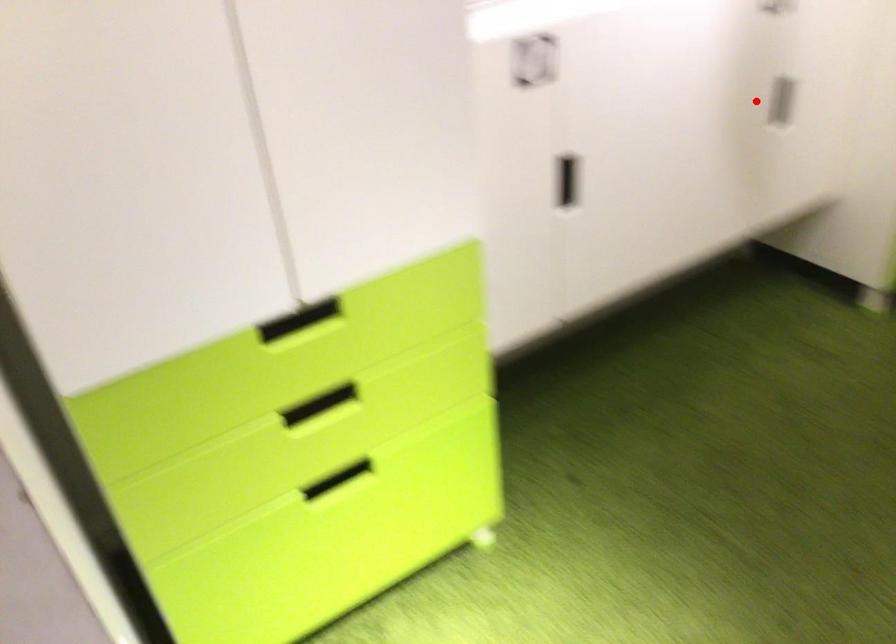
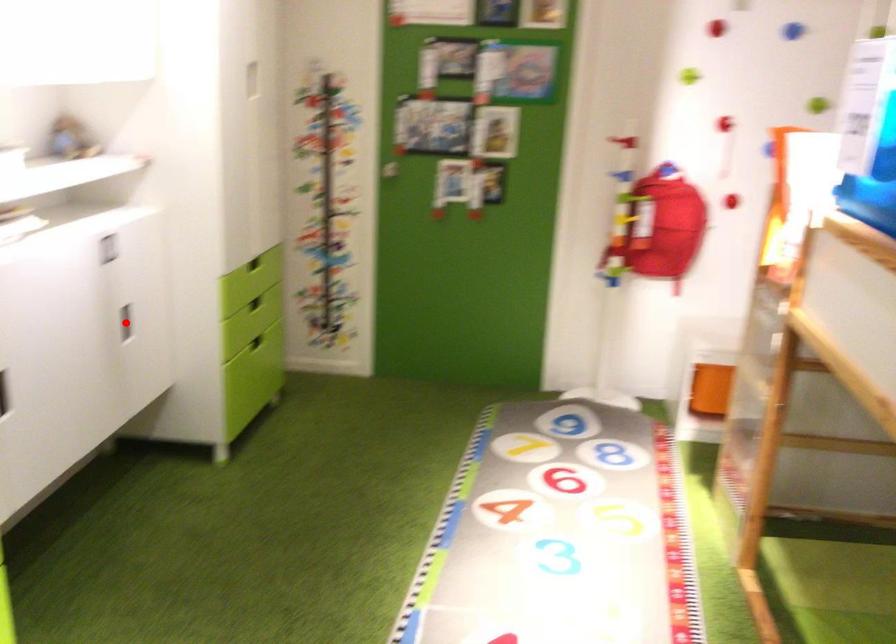
I am providing you with two images of the same scene from different viewpoints. A red point is marked on the first image and another point is marked on the second image. Do the highlighted points in image1 and image2 indicate the same real-world spot?

Yes